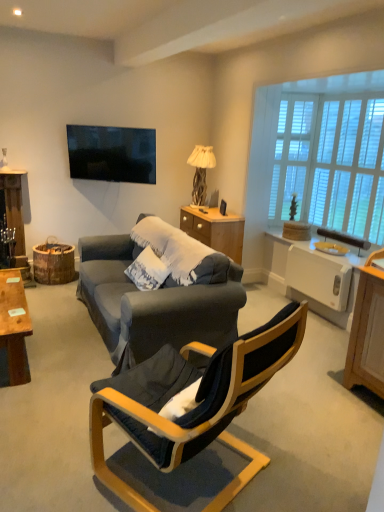
Question: Is white textured pillow at center in front of or behind white wooden window at upper right, which is the 1th window in left-to-right order, in the image?

Choices:
 (A) front
 (B) behind

Answer: (B)

Question: Considering the positions of white textured pillow at center and white wooden window at upper right, which is the 1th window in left-to-right order, in the image, is white textured pillow at center wider or thinner than white wooden window at upper right, which is the 1th window in left-to-right order,?

Choices:
 (A) wide
 (B) thin

Answer: (A)

Question: Which of these objects is positioned farthest from the white plastic toaster at right?

Choices:
 (A) wooden desk at left
 (B) woodenmaterial/texturedresser at center
 (C) wooden textured lamp at center
 (D) yellow plastic loudspeaker at upper right
 (E) white textured pillow at center

Answer: (A)

Question: Which object is positioned farthest from the velvet dark blue chair at center?

Choices:
 (A) wooden textured lamp at center
 (B) white plastic toaster at right
 (C) woodenmaterial/texturedresser at center
 (D) white matte window screen at upper right
 (E) wooden desk at left

Answer: (A)